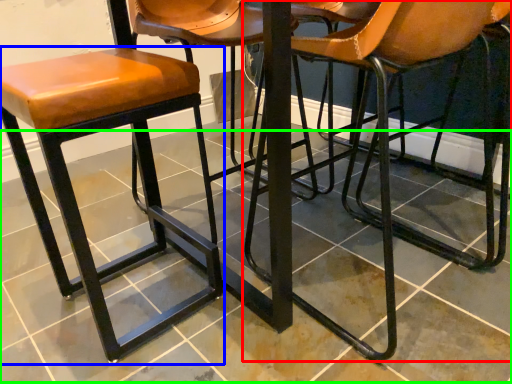
Question: Which object is positioned farthest from chair (highlighted by a red box)? Select from stool (highlighted by a blue box) and tile (highlighted by a green box).

Choices:
 (A) stool
 (B) tile

Answer: (A)